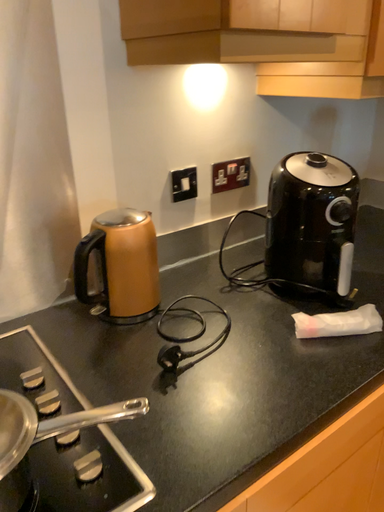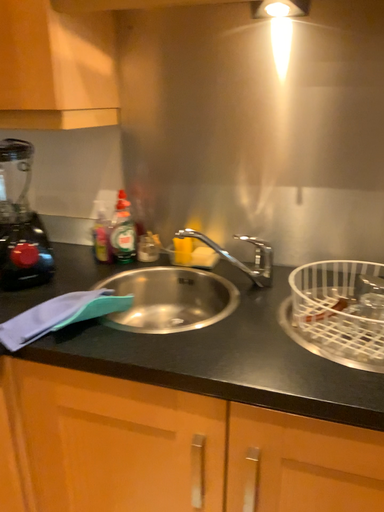
Question: How did the camera likely rotate when shooting the video?

Choices:
 (A) rotated upward
 (B) rotated downward

Answer: (A)